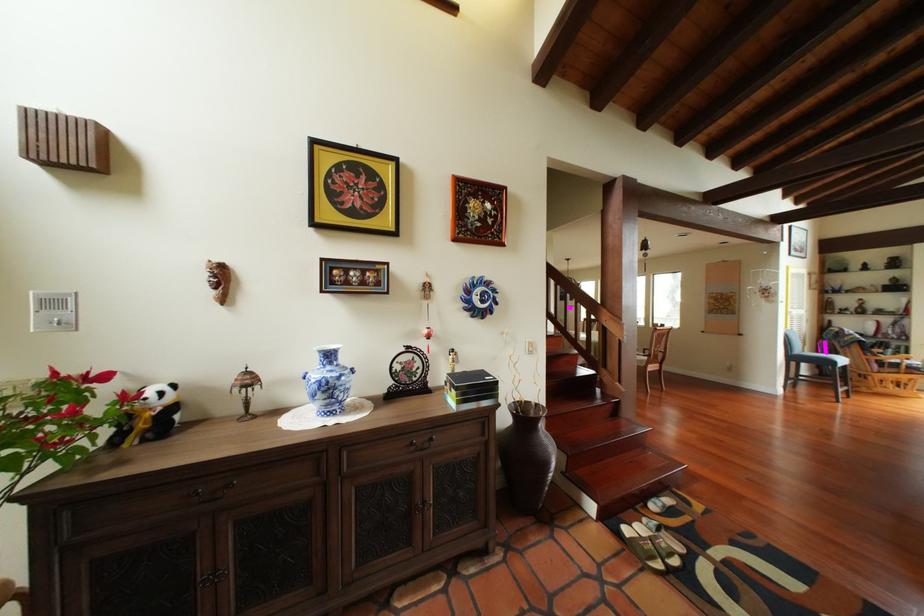
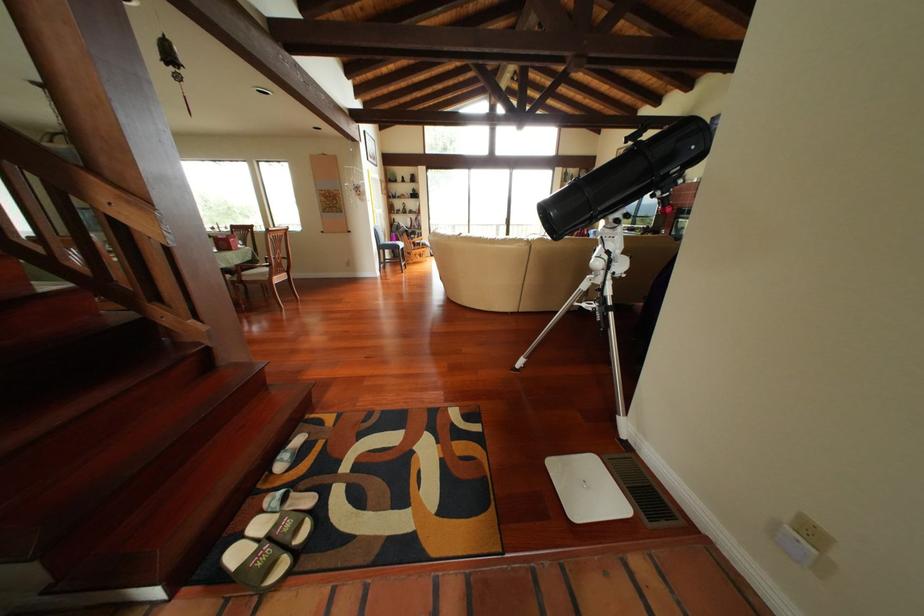
The first image is from the beginning of the video and the second image is from the end. How did the camera likely rotate when shooting the video?

The camera rotated toward right-down.